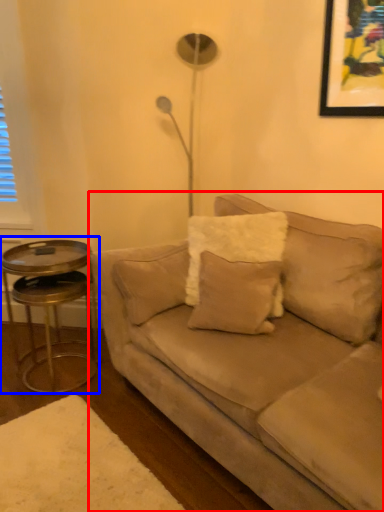
Question: Among these objects, which one is nearest to the camera, studio couch (highlighted by a red box) or table (highlighted by a blue box)?

Choices:
 (A) studio couch
 (B) table

Answer: (A)